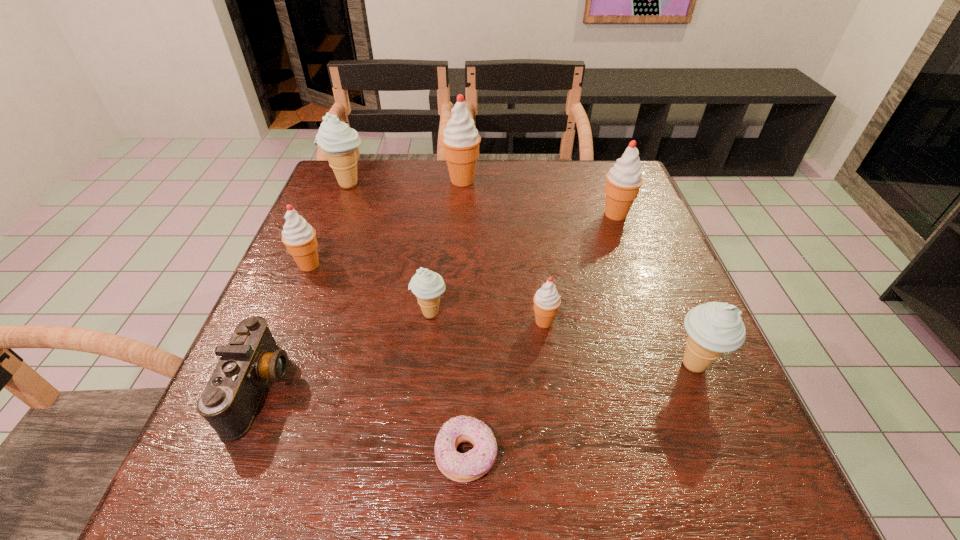
I want to click on the tallest object, so click(460, 139).

I want to click on the biggest red icecream, so click(x=460, y=139).

The width and height of the screenshot is (960, 540). Find the location of `the biggest beige icecream`. the biggest beige icecream is located at coordinates (339, 142).

At what (x,y) coordinates should I click in order to perform the action: click on the farthest beige icecream. Please return your answer as a coordinate pair (x, y). The width and height of the screenshot is (960, 540). Looking at the image, I should click on (339, 142).

Find the location of a particular element. This screenshot has height=540, width=960. the rightmost red icecream is located at coordinates (624, 180).

Locate an element on the screen. The height and width of the screenshot is (540, 960). the fifth nearest icecream is located at coordinates (624, 180).

In order to click on the second smallest red icecream in this screenshot , I will do click(299, 237).

Identify the location of the fourth farthest icecream. This screenshot has height=540, width=960. (299, 237).

Where is `the rightmost beige icecream`? This screenshot has height=540, width=960. the rightmost beige icecream is located at coordinates (713, 328).

This screenshot has width=960, height=540. Find the location of `the nearest beige icecream`. the nearest beige icecream is located at coordinates (713, 328).